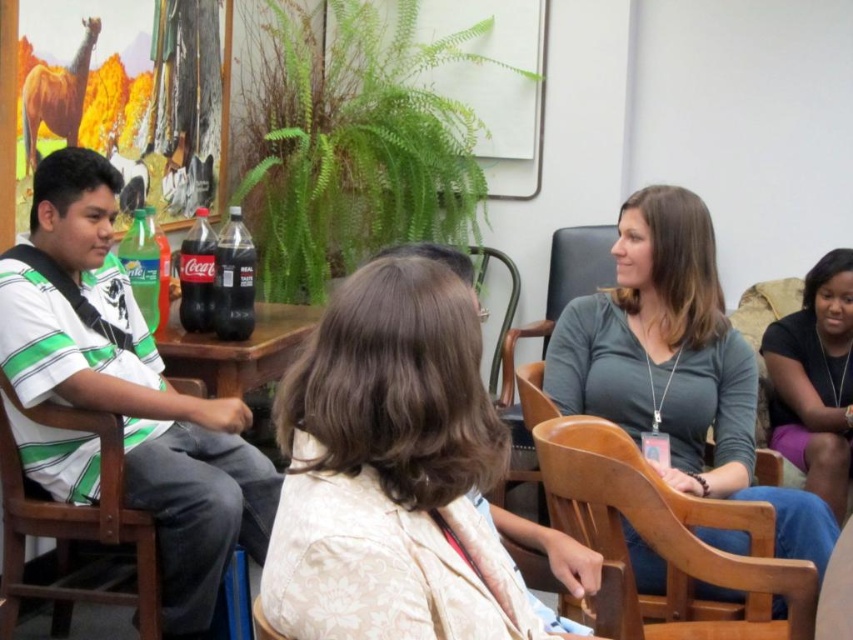
You are standing at the center of the room and want to move to the wooden chair at left located at point (79, 525). Is there any obstruction between your current position and the chair?

The wooden chair at left is located at point (79, 525). Since the chairs are arranged in a semi circle around the table, there might be other chairs or objects in between your current position and the target chair. However, without specific information about the exact arrangement of the chairs, it is impossible to determine if there is an obstruction. Please check the layout of the chairs to ensure a clear path.

You are sitting in the wooden chair at left and want to hand a document to the person wearing the gray matte shirt at center. Can you reach them directly without moving from your seat?

The gray matte shirt at center is in front of the wooden chair at left, so you can reach them directly without needing to move from your seat.

You are organizing a small event and need to ensure that seating arrangements accommodate both the white striped shirt at left and the wooden chair at left. Based on their sizes, which one requires more space?

The white striped shirt at left requires more space because it has a larger size compared to the wooden chair at left.